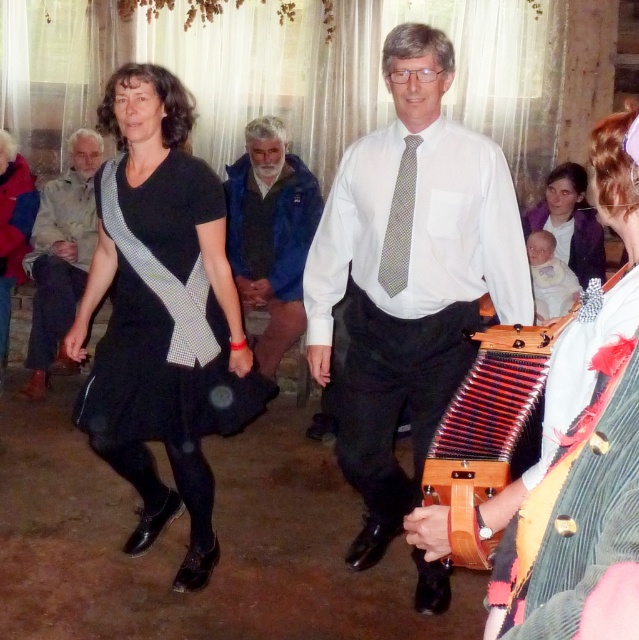
Question: Which point is closer to the camera?

Choices:
 (A) (566, 246)
 (B) (610, 400)
 (C) (406, 198)

Answer: (B)

Question: Is light brown leather jacket at left to the left of matte purple sweater at upper right from the viewer's perspective?

Choices:
 (A) no
 (B) yes

Answer: (B)

Question: Which object is positioned closest to the wooden accordion at center?

Choices:
 (A) white shirt at center
 (B) light brown leather jacket at left
 (C) gray dotted tie at center

Answer: (A)

Question: Can you confirm if black checkered dress at center is positioned to the right of matte purple sweater at upper right?

Choices:
 (A) no
 (B) yes

Answer: (A)

Question: Does wooden accordion at center come behind light brown leather jacket at left?

Choices:
 (A) no
 (B) yes

Answer: (A)

Question: Estimate the real-world distances between objects in this image. Which object is farther from the knitted wool sweater at right?

Choices:
 (A) gray dotted tie at center
 (B) wooden accordion at center
 (C) light brown leather jacket at left

Answer: (C)